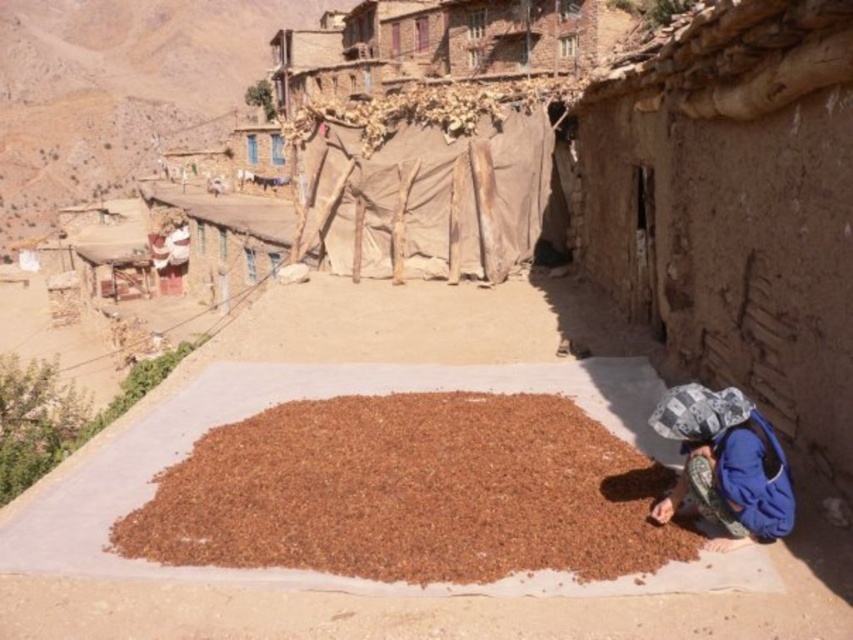
Is point (109, 538) positioned after point (717, 426)?

That is True.

Which is above, brown gravel at center or blue fabric at lower right?

blue fabric at lower right is higher up.

Locate an element on the screen. The height and width of the screenshot is (640, 853). brown gravel at center is located at coordinates (410, 492).